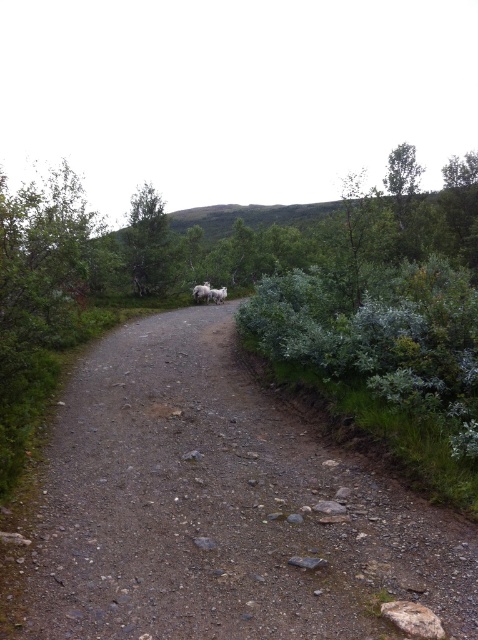
Question: Which point appears closest to the camera in this image?

Choices:
 (A) (206, 436)
 (B) (133, 234)

Answer: (A)

Question: Does dusty gravel path at center appear on the right side of green leafy tree at upper center?

Choices:
 (A) yes
 (B) no

Answer: (A)

Question: Observing the image, what is the correct spatial positioning of dusty gravel path at center in reference to green leafy tree at upper center?

Choices:
 (A) right
 (B) left

Answer: (A)

Question: Can you confirm if dusty gravel path at center is bigger than green leafy tree at upper center?

Choices:
 (A) no
 (B) yes

Answer: (A)